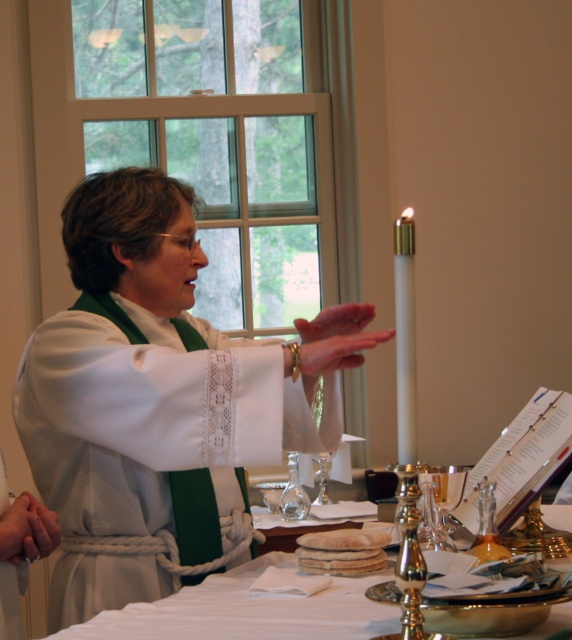
You are standing in the religious setting and see the point marked at coordinates (404,337). Which object is this point located on?

The point marked at coordinates (404,337) is located on the white polished candle at upper right.

You are a guest at this ceremony and want to place a small token on the white cloth at center without touching the clear glass wine glass at center. Can you do this easily?

The white cloth at center is closer to the viewer than the clear glass wine glass at center, so yes, you can place the token on the white cloth at center without touching the wine glass since it is farther away.

You are a guest at this ceremony and want to place a small note on the table. The note is exactly the same size as the white polished candle at upper right. Will it fit on the clear glass wine glass at center without overlapping the edges?

The white polished candle at upper right is narrower than the clear glass wine glass at center, so the note will fit on the clear glass wine glass at center without overlapping the edges.